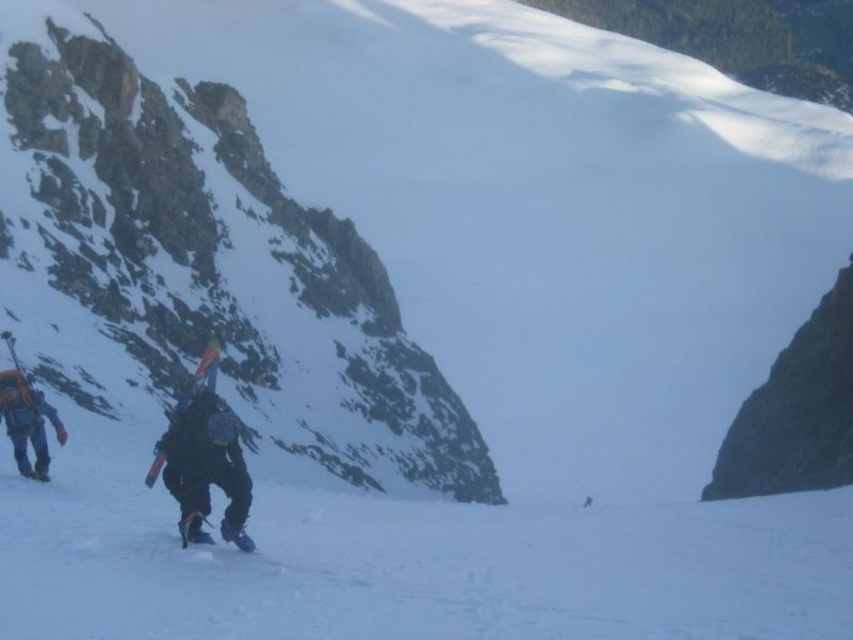
Question: Can you confirm if orange fabric backpack at left is positioned to the right of matte blue ski at center?

Choices:
 (A) yes
 (B) no

Answer: (B)

Question: Which of the following is the farthest from the observer?

Choices:
 (A) black fabric backpack at lower left
 (B) matte blue ski at center
 (C) orange fabric backpack at left

Answer: (C)

Question: Can you confirm if black fabric backpack at lower left is thinner than orange fabric backpack at left?

Choices:
 (A) no
 (B) yes

Answer: (B)

Question: Can you confirm if black fabric backpack at lower left is smaller than orange fabric backpack at left?

Choices:
 (A) yes
 (B) no

Answer: (A)

Question: Which object is farther from the camera taking this photo?

Choices:
 (A) matte blue ski at center
 (B) orange fabric backpack at left
 (C) black fabric backpack at lower left

Answer: (B)

Question: Which object appears farthest from the camera in this image?

Choices:
 (A) matte blue ski at center
 (B) orange fabric backpack at left

Answer: (B)